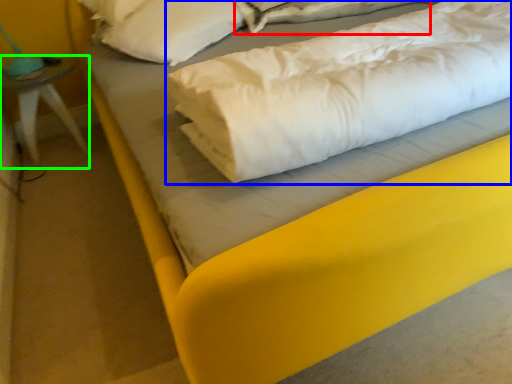
Question: Estimate the real-world distances between objects in this image. Which object is closer to sheet (highlighted by a red box), linen (highlighted by a blue box) or furniture (highlighted by a green box)?

Choices:
 (A) linen
 (B) furniture

Answer: (A)